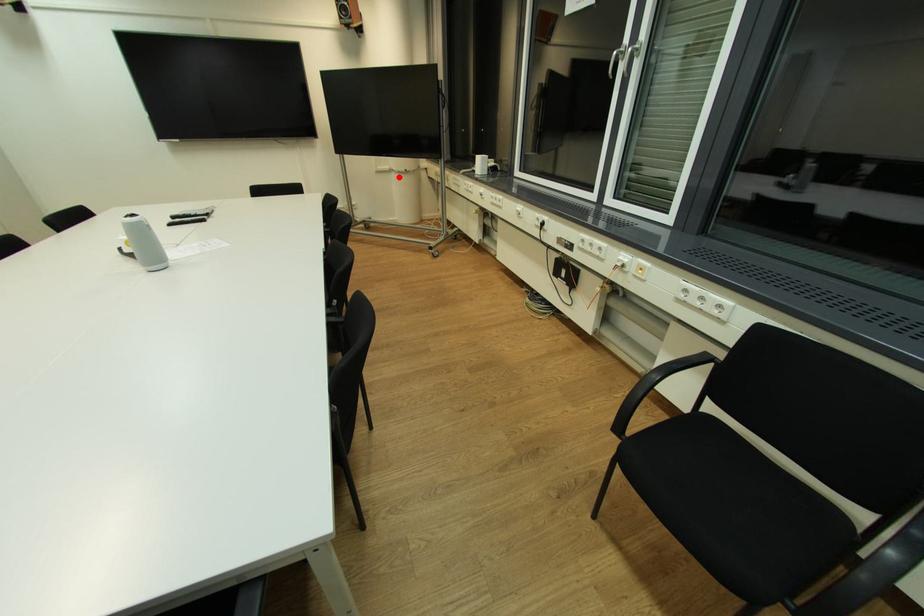
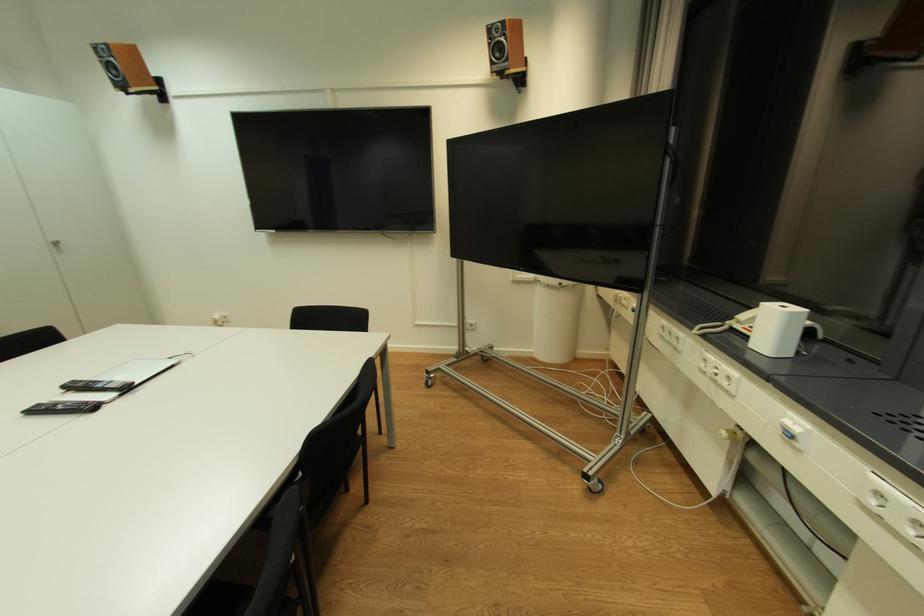
Locate, in the second image, the point that corresponds to the highlighted location in the first image.

(544, 290)